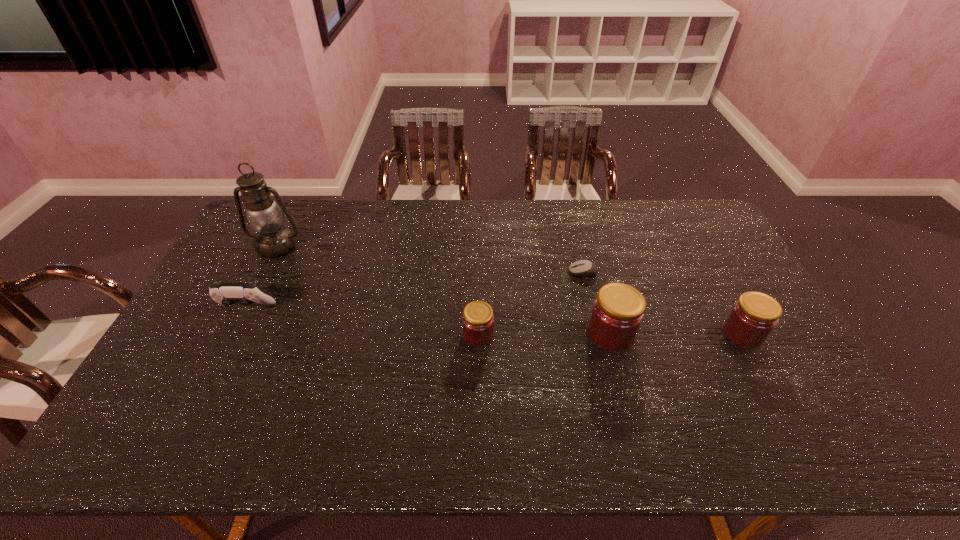
At what (x,y) coordinates should I click in order to perform the action: click on oil lamp present at the left edge. Please return your answer as a coordinate pair (x, y). Looking at the image, I should click on (264, 215).

Find the location of `control present at the left edge`. control present at the left edge is located at coordinates (226, 294).

The height and width of the screenshot is (540, 960). I want to click on object that is positioned at the right edge, so click(x=753, y=317).

Locate an element on the screen. object at the far left corner is located at coordinates (264, 215).

At what (x,y) coordinates should I click in order to perform the action: click on free space at the far edge of the desktop. Please return your answer as a coordinate pair (x, y). Looking at the image, I should click on (468, 220).

Locate an element on the screen. free space at the near edge is located at coordinates (282, 392).

Find the location of a particular element. The image size is (960, 540). vacant point at the left edge is located at coordinates (226, 274).

Where is `free location at the near left corner of the desktop`? free location at the near left corner of the desktop is located at coordinates (171, 401).

Locate an element on the screen. This screenshot has width=960, height=540. vacant space at the far right corner of the desktop is located at coordinates (693, 208).

Find the location of a particular element. The image size is (960, 540). vacant area that lies between the rightmost jam and the oil lamp is located at coordinates (510, 290).